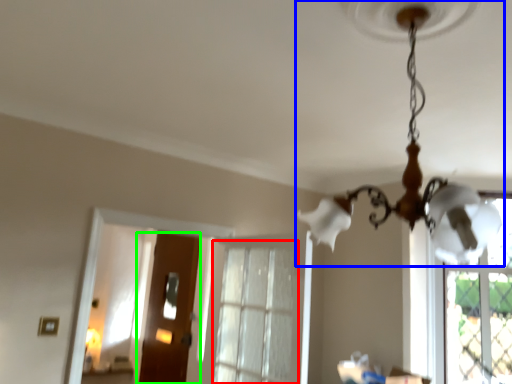
Question: Based on their relative distances, which object is nearer to window (highlighted by a red box)? Choose from lamp (highlighted by a blue box) and door (highlighted by a green box).

Choices:
 (A) lamp
 (B) door

Answer: (B)